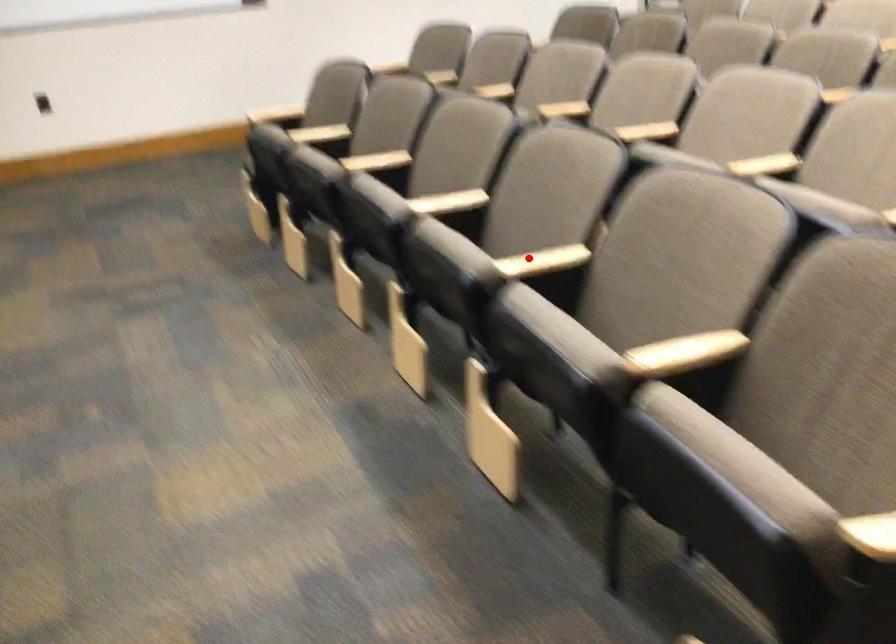
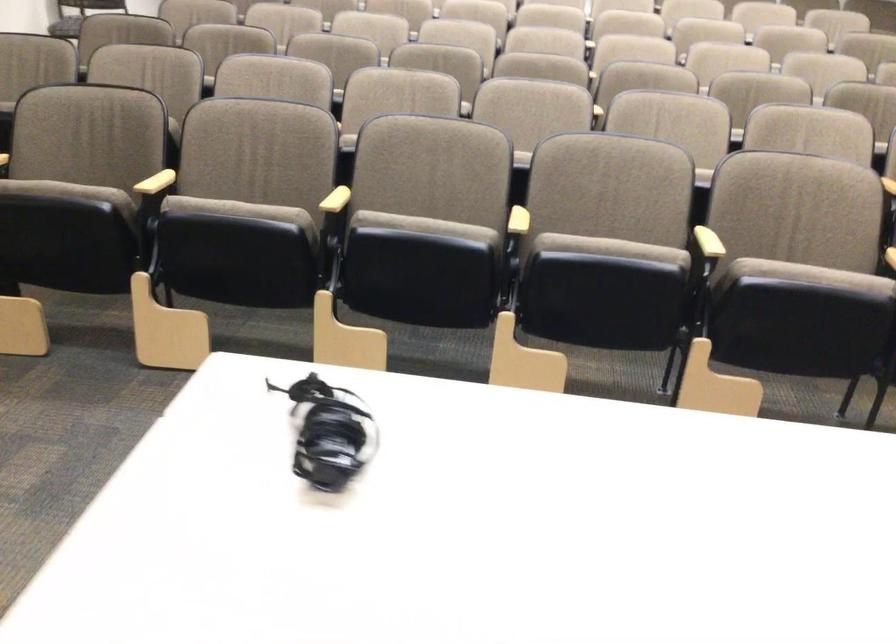
Question: I am providing you with two images of the same scene from different viewpoints. A red point is shown in image1. For the corresponding object point in image2, is it positioned nearer or farther from the camera?

Choices:
 (A) Nearer
 (B) Farther

Answer: (B)